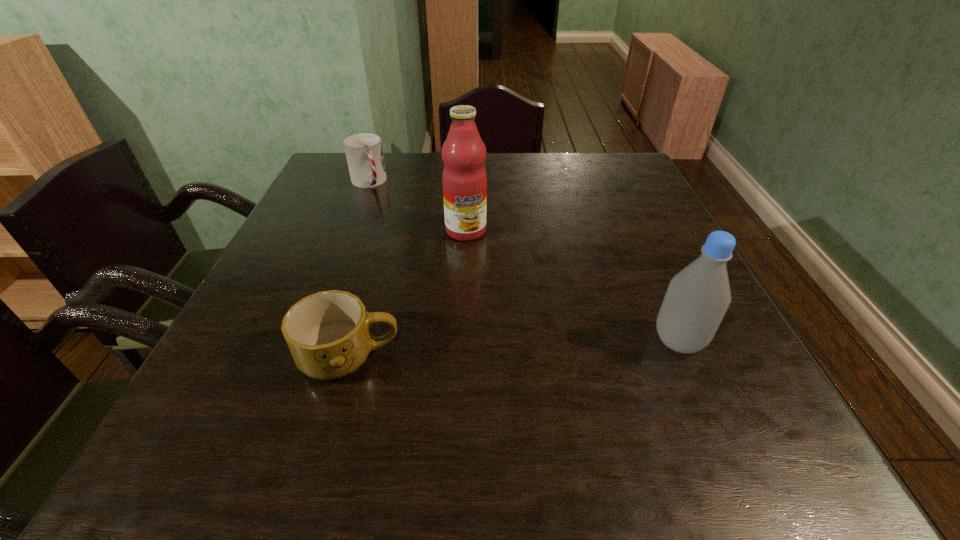
Where is `object positioned at the near left corner`? This screenshot has width=960, height=540. object positioned at the near left corner is located at coordinates (328, 333).

Locate an element on the screen. This screenshot has width=960, height=540. vacant space at the far edge of the desktop is located at coordinates (392, 157).

I want to click on vacant space at the near edge of the desktop, so click(553, 405).

In the image, there is a desktop. Where is `vacant space at the left edge`? vacant space at the left edge is located at coordinates (288, 295).

You are a GUI agent. You are given a task and a screenshot of the screen. Output one action in this format:
    pyautogui.click(x=<x>, y=<y>)
    Task: Click on the vacant region at the right edge of the desktop
    
    Given the screenshot: What is the action you would take?
    pyautogui.click(x=626, y=222)

The height and width of the screenshot is (540, 960). What are the coordinates of `vacant space at the far right corner of the desktop` in the screenshot? It's located at (601, 170).

Identify the location of free area in between the farthest object and the rightmost object. The image size is (960, 540). (523, 261).

What are the coordinates of `free space between the rightmost object and the second farthest object` in the screenshot? It's located at (572, 286).

Locate an element on the screen. vacant point located between the farthest object and the bottle is located at coordinates (523, 261).

Image resolution: width=960 pixels, height=540 pixels. Find the location of `free spot between the cup and the rightmost object`. free spot between the cup and the rightmost object is located at coordinates (523, 261).